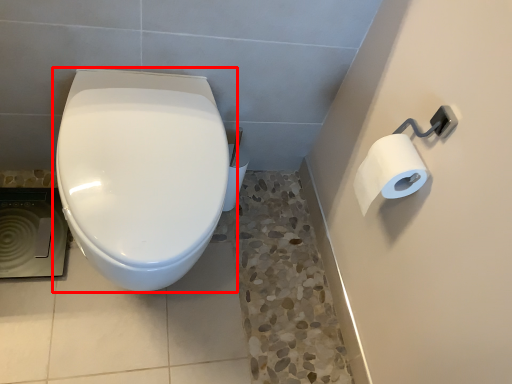
Question: From the image's perspective, where is toilet (annotated by the red box) located in relation to toilet paper in the image?

Choices:
 (A) above
 (B) below

Answer: (B)